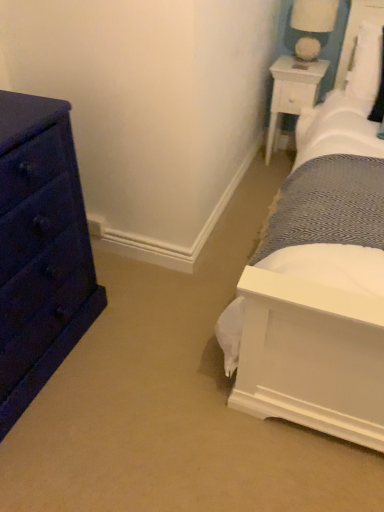
Question: From the image's perspective, is white wood nightstand at upper right beneath white fabric-covered lampshade at upper right?

Choices:
 (A) yes
 (B) no

Answer: (A)

Question: From a real-world perspective, is white wood nightstand at upper right physically above white fabric-covered lampshade at upper right?

Choices:
 (A) no
 (B) yes

Answer: (A)

Question: Could you tell me if white wood nightstand at upper right is turned towards white fabric-covered lampshade at upper right?

Choices:
 (A) no
 (B) yes

Answer: (A)

Question: From the image's perspective, is white wood nightstand at upper right on white fabric-covered lampshade at upper right?

Choices:
 (A) yes
 (B) no

Answer: (B)

Question: Is white wood nightstand at upper right surrounding white fabric-covered lampshade at upper right?

Choices:
 (A) no
 (B) yes

Answer: (A)

Question: In terms of width, does white wood nightstand at upper right look wider or thinner when compared to white fabric-covered lampshade at upper right?

Choices:
 (A) wide
 (B) thin

Answer: (A)

Question: Which is correct: white wood nightstand at upper right is inside white fabric-covered lampshade at upper right, or outside of it?

Choices:
 (A) outside
 (B) inside

Answer: (A)

Question: Based on their positions, is white wood nightstand at upper right located to the left or right of white fabric-covered lampshade at upper right?

Choices:
 (A) left
 (B) right

Answer: (A)

Question: Is white wood nightstand at upper right in front of or behind white fabric-covered lampshade at upper right in the image?

Choices:
 (A) behind
 (B) front

Answer: (A)

Question: Considering the positions of white fabric-covered lampshade at upper right and matte dark blue dresser at left in the image, is white fabric-covered lampshade at upper right taller or shorter than matte dark blue dresser at left?

Choices:
 (A) short
 (B) tall

Answer: (A)

Question: From the image's perspective, is white fabric-covered lampshade at upper right above or below matte dark blue dresser at left?

Choices:
 (A) above
 (B) below

Answer: (A)

Question: Choose the correct answer: Is white fabric-covered lampshade at upper right inside matte dark blue dresser at left or outside it?

Choices:
 (A) outside
 (B) inside

Answer: (A)

Question: In terms of width, does white fabric-covered lampshade at upper right look wider or thinner when compared to matte dark blue dresser at left?

Choices:
 (A) wide
 (B) thin

Answer: (B)

Question: Is white fabric-covered lampshade at upper right in front of or behind white wood nightstand at upper right in the image?

Choices:
 (A) behind
 (B) front

Answer: (B)

Question: Looking at the image, does white fabric-covered lampshade at upper right seem bigger or smaller compared to white wood nightstand at upper right?

Choices:
 (A) big
 (B) small

Answer: (B)